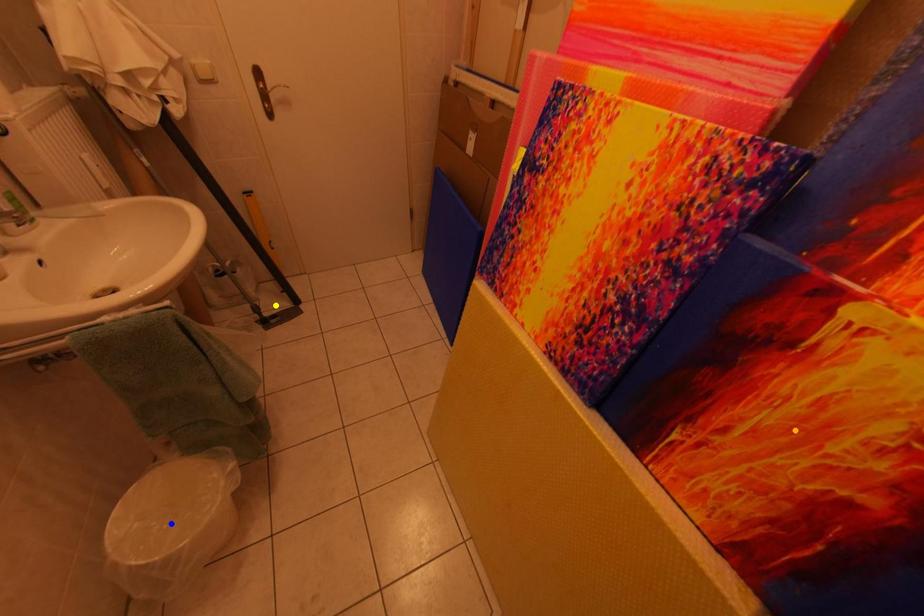
Order these from nearest to farthest:
- blue point
- orange point
- yellow point

orange point, blue point, yellow point